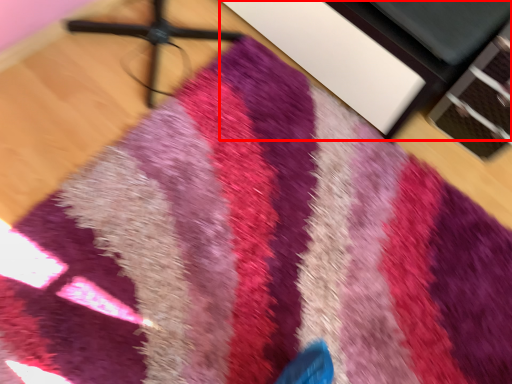
Question: From the image, what is the correct spatial relationship of furniture (annotated by the red box) in relation to tripod?

Choices:
 (A) left
 (B) right

Answer: (B)